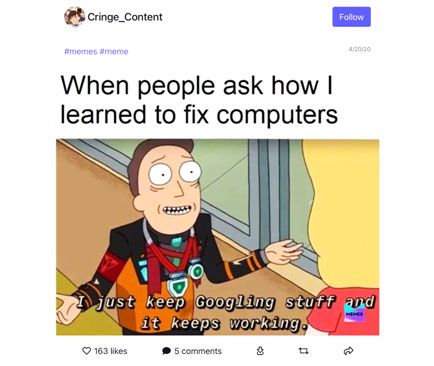
Find the location of a particular element. This screenshot has width=434, height=366. wall is located at coordinates (83, 231).